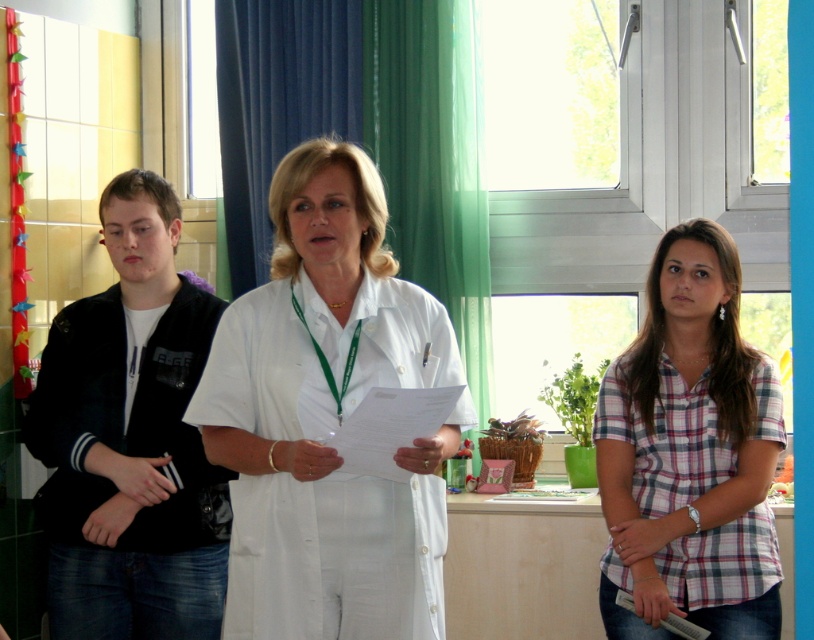
You are a photographer trying to capture a group photo of the white matte uniform at center and the plaid cotton shirt at center. Since you want to ensure both subjects are fully visible, which subject should you position closer to the camera to avoid being blocked by the other?

The plaid cotton shirt at center should be positioned closer to the camera because the white matte uniform at center is taller than the plaid cotton shirt at center, so placing the shorter one forward prevents obstruction.

You are a delivery robot with a package that needs to be handed to the person wearing the plaid cotton shirt at center. You are currently positioned next to the black matte jacket at left. The package is 1.2 meters long. Can you extend your arm to hand the package without moving your position?

The black matte jacket at left and plaid cotton shirt at center are 1.12 meters apart from each other. Since the package is 1.2 meters long, the robot can extend its arm to reach the plaid cotton shirt at center as the distance between them is less than the package length.